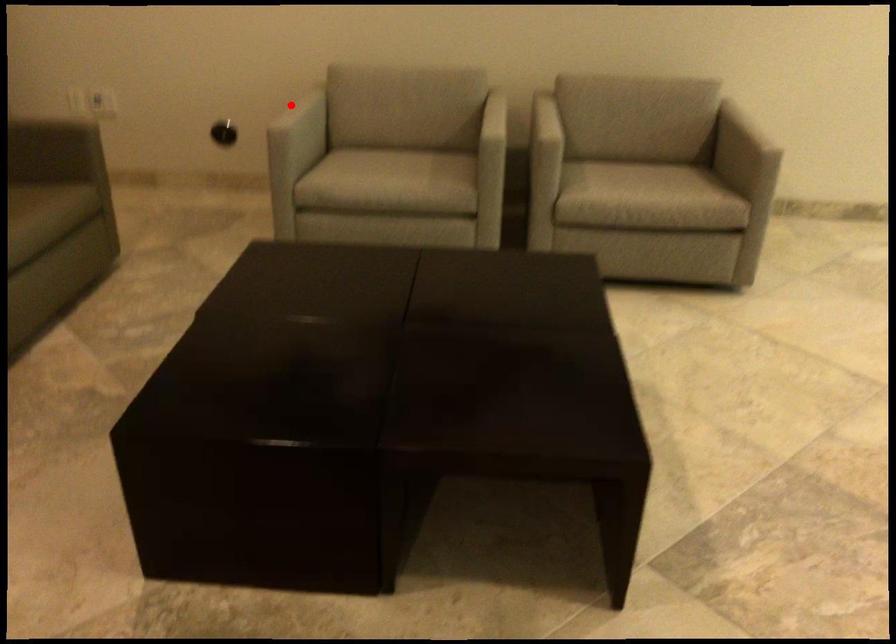
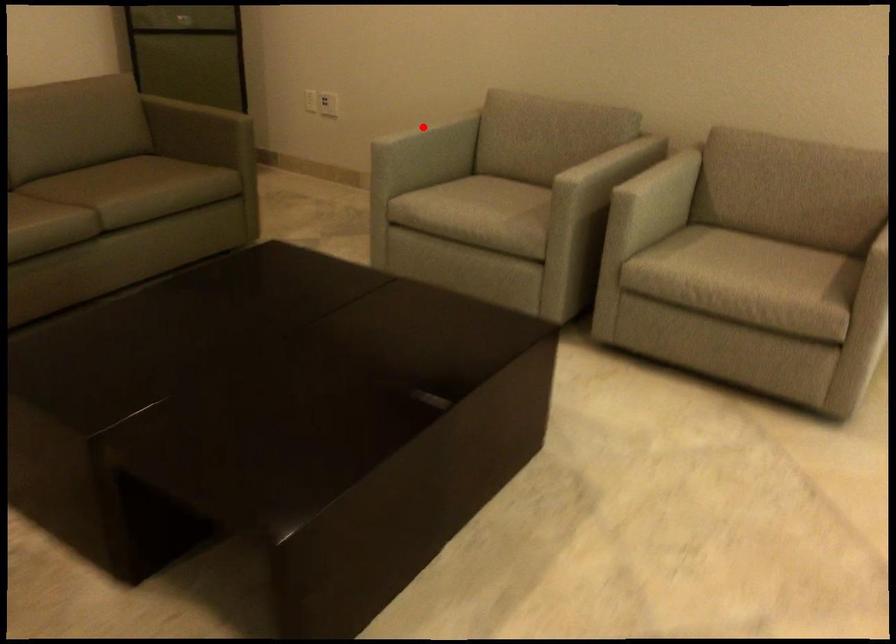
I am providing you with two images of the same scene from different viewpoints. A red point is marked on the first image and another point is marked on the second image. Is the marked point in image1 the same physical position as the marked point in image2?

Yes